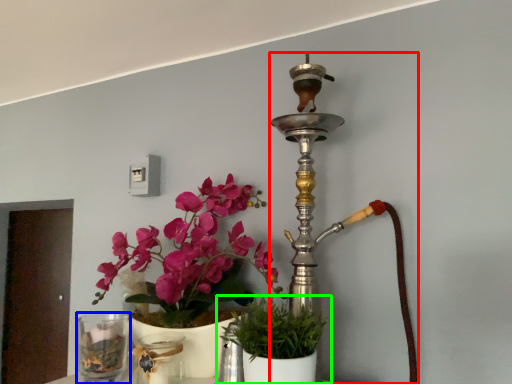
Question: Which object is positioned closest to candle holder (highlighted by a red box)? Select from vase (highlighted by a blue box) and houseplant (highlighted by a green box).

Choices:
 (A) vase
 (B) houseplant

Answer: (B)